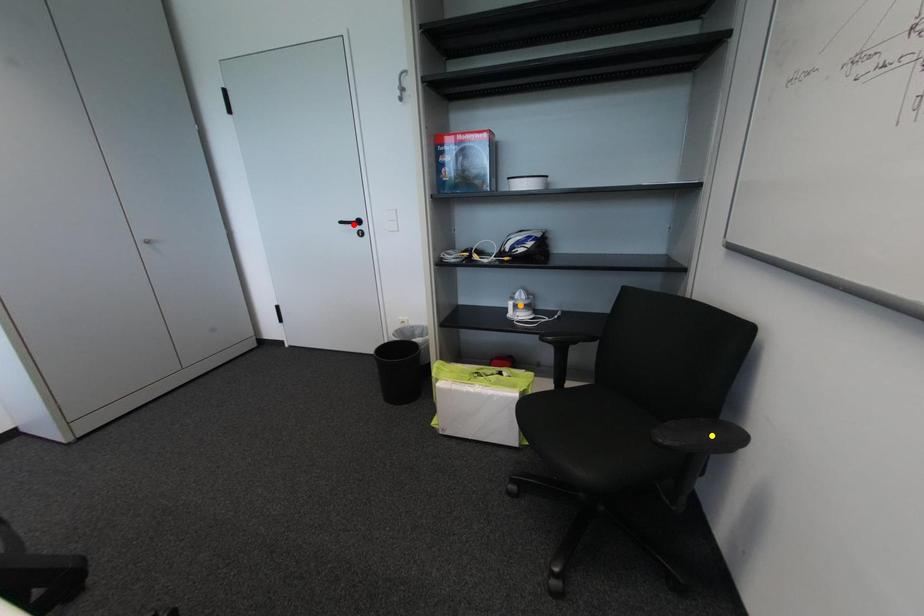
Order these from farthest to nearest:
A) yellow point
B) red point
C) orange point

red point < orange point < yellow point